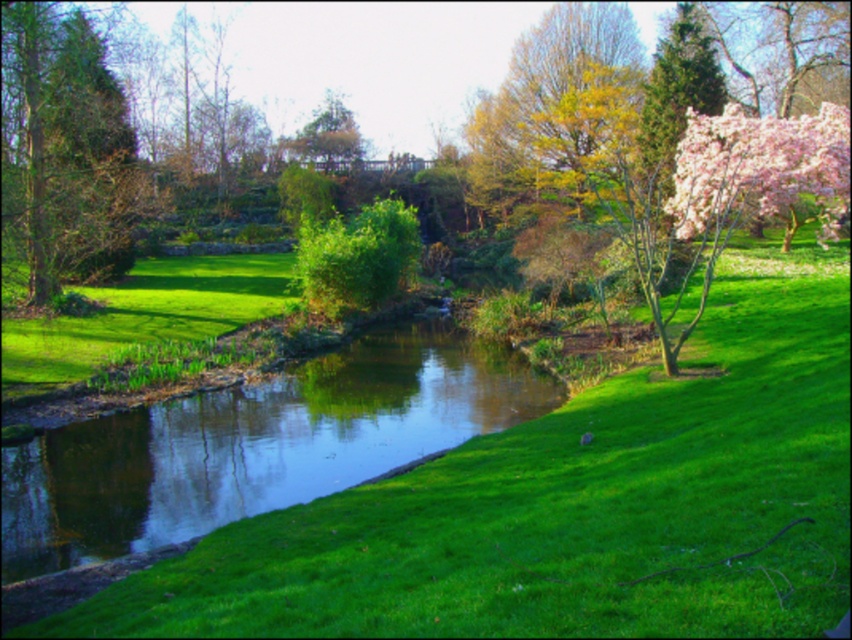
Which is below, green grassy at center or green leafy tree at upper center?

green grassy at center is below.

Is green grassy at center shorter than green leafy tree at upper center?

Yes.

Does point (165, 564) come closer to viewer compared to point (311, 147)?

Yes, point (165, 564) is closer to viewer.

At what (x,y) coordinates should I click in order to perform the action: click on green grassy at center. Please return your answer as a coordinate pair (x, y). This screenshot has width=852, height=640. Looking at the image, I should click on (573, 506).

From the picture: Does green grassy at center come behind green grassy stream at center?

No, green grassy at center is closer to the viewer.

Who is positioned more to the left, green grassy at center or green grassy stream at center?

green grassy stream at center is more to the left.

Is point (820, 417) in front of point (384, 337)?

Yes, point (820, 417) is closer to viewer.

Find the location of a particular element. The width and height of the screenshot is (852, 640). green grassy at center is located at coordinates (573, 506).

Which of these two, green grassy at center or green textured tree at left, stands shorter?

With less height is green grassy at center.

Can you confirm if green grassy at center is smaller than green textured tree at left?

Yes, green grassy at center is smaller than green textured tree at left.

Locate an element on the screen. The height and width of the screenshot is (640, 852). green grassy at center is located at coordinates (573, 506).